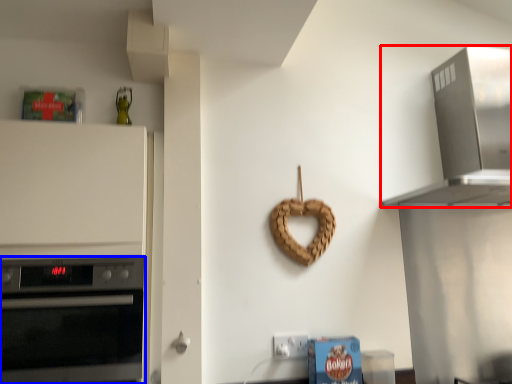
Question: Which of the following is the farthest to the observer, home appliance (highlighted by a red box) or oven (highlighted by a blue box)?

Choices:
 (A) home appliance
 (B) oven

Answer: (A)